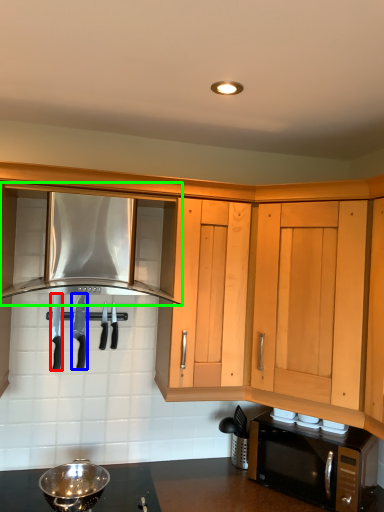
Question: Estimate the real-world distances between objects in this image. Which object is closer to knife (highlighted by a red box), knife (highlighted by a blue box) or cabinetry (highlighted by a green box)?

Choices:
 (A) knife
 (B) cabinetry

Answer: (A)